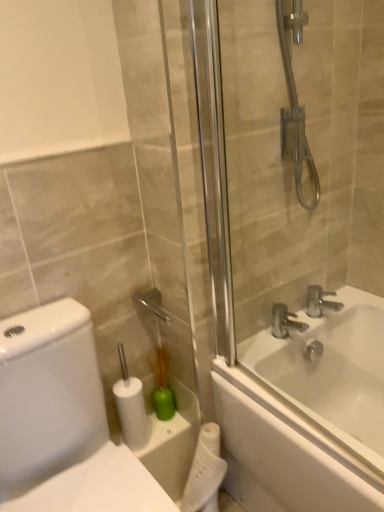
What do you see at coordinates (273, 160) in the screenshot?
I see `transparent glass shower door at right` at bounding box center [273, 160].

What do you see at coordinates (205, 472) in the screenshot? I see `white matte toilet paper at lower center, which is the first toilet paper from right to left` at bounding box center [205, 472].

Locate an element on the screen. Image resolution: width=384 pixels, height=512 pixels. white matte toilet paper at lower center, the 2th toilet paper when ordered from left to right is located at coordinates (205, 472).

What do you see at coordinates (62, 421) in the screenshot? I see `white glossy toilet at left` at bounding box center [62, 421].

Locate an element on the screen. transparent glass shower door at right is located at coordinates (273, 160).

In terms of width, does white glossy bathtub at center look wider or thinner when compared to white glossy toilet at left?

In the image, white glossy bathtub at center appears to be wider than white glossy toilet at left.

Do you think white glossy bathtub at center is within white glossy toilet at left, or outside of it?

white glossy bathtub at center exists outside the volume of white glossy toilet at left.

Considering the sizes of white glossy bathtub at center and white glossy toilet at left in the image, is white glossy bathtub at center taller or shorter than white glossy toilet at left?

white glossy bathtub at center is shorter than white glossy toilet at left.

Considering the sizes of white glossy toilet at left and silver metallic faucet at upper right, marked as the 2th tap in a left-to-right arrangement, in the image, is white glossy toilet at left wider or thinner than silver metallic faucet at upper right, marked as the 2th tap in a left-to-right arrangement,?

white glossy toilet at left is wider than silver metallic faucet at upper right, marked as the 2th tap in a left-to-right arrangement.

Is white glossy toilet at left shorter than silver metallic faucet at upper right, marked as the 2th tap in a left-to-right arrangement?

Incorrect, the height of white glossy toilet at left does not fall short of that of silver metallic faucet at upper right, marked as the 2th tap in a left-to-right arrangement.

Who is bigger, white glossy toilet at left or silver metallic faucet at upper right, marked as the 2th tap in a left-to-right arrangement?

With larger size is white glossy toilet at left.

From the image's perspective, would you say white glossy toilet at left is positioned over silver metallic faucet at upper right, marked as the 2th tap in a left-to-right arrangement?

No, from the image's perspective, white glossy toilet at left is not over silver metallic faucet at upper right, marked as the 2th tap in a left-to-right arrangement.

Considering the positions of objects silver metallic faucet at upper right, which is the 1th tap in right-to-left order, and white matte toilet paper at lower center, which is counted as the second toilet paper, starting from the right, in the image provided, who is in front, silver metallic faucet at upper right, which is the 1th tap in right-to-left order, or white matte toilet paper at lower center, which is counted as the second toilet paper, starting from the right,?

white matte toilet paper at lower center, which is counted as the second toilet paper, starting from the right.

Consider the image. Is silver metallic faucet at upper right, which is the 1th tap in right-to-left order, not near white matte toilet paper at lower center, which is counted as the second toilet paper, starting from the right?

No.

Looking at this image, from a real-world perspective, relative to white matte toilet paper at lower center, which is counted as the second toilet paper, starting from the right, is silver metallic faucet at upper right, marked as the 2th tap in a left-to-right arrangement, vertically above or below?

silver metallic faucet at upper right, marked as the 2th tap in a left-to-right arrangement, is above white matte toilet paper at lower center, which is counted as the second toilet paper, starting from the right.

Is point (310, 295) less distant than point (143, 437)?

No, it is not.

Is silver metallic faucet at upper right, which is the 1th tap in right-to-left order, located outside silver metallic faucet at upper right, the 1th tap from the left?

Yes, silver metallic faucet at upper right, which is the 1th tap in right-to-left order, is located beyond the bounds of silver metallic faucet at upper right, the 1th tap from the left.

Is silver metallic faucet at upper right, marked as the 2th tap in a left-to-right arrangement, aimed at silver metallic faucet at upper right, positioned as the 2th tap in right-to-left order?

No, silver metallic faucet at upper right, marked as the 2th tap in a left-to-right arrangement, is not aimed at silver metallic faucet at upper right, positioned as the 2th tap in right-to-left order.

From a real-world perspective, is silver metallic faucet at upper right, which is the 1th tap in right-to-left order, on silver metallic faucet at upper right, positioned as the 2th tap in right-to-left order?

Correct, in the physical world, silver metallic faucet at upper right, which is the 1th tap in right-to-left order, is higher than silver metallic faucet at upper right, positioned as the 2th tap in right-to-left order.

Is silver metallic faucet at upper right, which is the 1th tap in right-to-left order, not close to silver metallic faucet at upper right, the 1th tap from the left?

That's not correct — silver metallic faucet at upper right, which is the 1th tap in right-to-left order, is a little close to silver metallic faucet at upper right, the 1th tap from the left.

Looking at this image, from the image's perspective, which one is positioned higher, white glossy toilet at left or green plastic brush at lower center?

From the image's view, green plastic brush at lower center is above.

Based on the photo, do you think white glossy toilet at left is within green plastic brush at lower center, or outside of it?

white glossy toilet at left lies outside green plastic brush at lower center.

Could you tell me if white glossy toilet at left is turned towards green plastic brush at lower center?

No, white glossy toilet at left is not oriented towards green plastic brush at lower center.

Would you say transparent glass shower door at right is outside silver metallic faucet at upper right, the 1th tap from the left?

transparent glass shower door at right lies outside silver metallic faucet at upper right, the 1th tap from the left,'s area.

From a real-world perspective, is transparent glass shower door at right physically located above or below silver metallic faucet at upper right, the 1th tap from the left?

Clearly, from a real-world perspective, transparent glass shower door at right is above silver metallic faucet at upper right, the 1th tap from the left.

Is point (277, 79) farther from viewer compared to point (280, 335)?

No.

Could you tell me if transparent glass shower door at right is facing silver metallic faucet at upper right, positioned as the 2th tap in right-to-left order?

No, transparent glass shower door at right is not turned towards silver metallic faucet at upper right, positioned as the 2th tap in right-to-left order.

Find the location of a particular element. This screenshot has width=384, height=512. the 2nd toilet paper below the silver metallic faucet at upper right, which is the 1th tap in right-to-left order (from the image's perspective) is located at coordinates (205, 472).

Is silver metallic faucet at upper right, which is the 1th tap in right-to-left order, beside white matte toilet paper at lower center, the 2th toilet paper when ordered from left to right?

They are not placed beside each other.

What's the angular difference between silver metallic faucet at upper right, marked as the 2th tap in a left-to-right arrangement, and white matte toilet paper at lower center, which is the first toilet paper from right to left,'s facing directions?

There is a 0.935-degree angle between the facing directions of silver metallic faucet at upper right, marked as the 2th tap in a left-to-right arrangement, and white matte toilet paper at lower center, which is the first toilet paper from right to left.

From a real-world perspective, is silver metallic faucet at upper right, which is the 1th tap in right-to-left order, physically above white matte toilet paper at lower center, which is the first toilet paper from right to left?

Indeed, from a real-world perspective, silver metallic faucet at upper right, which is the 1th tap in right-to-left order, stands above white matte toilet paper at lower center, which is the first toilet paper from right to left.

Identify the location of porcelain below the white glossy bathtub at center (from the image's perspective). (62, 421).

There is a white glossy toilet at left. Where is `the 2nd tap above it (from a real-world perspective)`? The height and width of the screenshot is (512, 384). the 2nd tap above it (from a real-world perspective) is located at coordinates (320, 301).

When comparing their distances from white glossy bathtub at center, does silver metallic faucet at upper right, the 1th tap from the left, or green plastic brush at lower center seem closer?

silver metallic faucet at upper right, the 1th tap from the left, is positioned closer to the anchor white glossy bathtub at center.

Estimate the real-world distances between objects in this image. Which object is further from white glossy bathtub at center, green plastic brush at lower center or white matte toilet paper at lower center, which is the 2th toilet paper in top-to-bottom order?

The object further to white glossy bathtub at center is green plastic brush at lower center.

Based on their spatial positions, is silver metallic faucet at upper right, positioned as the 2th tap in right-to-left order, or silver metallic faucet at upper right, marked as the 2th tap in a left-to-right arrangement, further from transparent glass shower door at right?

The object further to transparent glass shower door at right is silver metallic faucet at upper right, marked as the 2th tap in a left-to-right arrangement.

When comparing their distances from white glossy toilet at left, does silver metallic faucet at upper right, the 1th tap from the left, or white glossy bathtub at center seem further?

silver metallic faucet at upper right, the 1th tap from the left, is positioned further to the anchor white glossy toilet at left.

From the image, which object appears to be nearer to silver metallic faucet at upper right, the 1th tap from the left, white matte toilet paper at lower center, which is the 2th toilet paper in top-to-bottom order, or transparent glass shower door at right?

transparent glass shower door at right.

Which object lies nearer to the anchor point silver metallic faucet at upper right, positioned as the 2th tap in right-to-left order, silver metallic faucet at upper right, which is the 1th tap in right-to-left order, or white glossy bathtub at center?

Among the two, silver metallic faucet at upper right, which is the 1th tap in right-to-left order, is located nearer to silver metallic faucet at upper right, positioned as the 2th tap in right-to-left order.

Which object lies nearer to the anchor point white matte toilet paper at lower center, the 2th toilet paper in the bottom-to-top sequence, silver metallic faucet at upper right, which is the 1th tap in right-to-left order, or transparent glass shower door at right?

The object closer to white matte toilet paper at lower center, the 2th toilet paper in the bottom-to-top sequence, is transparent glass shower door at right.

Considering their positions, is white glossy bathtub at center positioned further to transparent glass shower door at right than white matte toilet paper at lower center, the 2th toilet paper in the bottom-to-top sequence?

Based on the image, white matte toilet paper at lower center, the 2th toilet paper in the bottom-to-top sequence, appears to be further to transparent glass shower door at right.

You are a GUI agent. You are given a task and a screenshot of the screen. Output one action in this format:
    pyautogui.click(x=<x>, y=<y>)
    Task: Click on the porcelain positioned between transparent glass shower door at right and silver metallic faucet at upper right, which is the 1th tap in right-to-left order, from near to far
    The height and width of the screenshot is (512, 384).
    Given the screenshot: What is the action you would take?
    pyautogui.click(x=62, y=421)

Find the location of a particular element. This screenshot has width=384, height=512. porcelain positioned between transparent glass shower door at right and white matte toilet paper at lower center, the 2th toilet paper in the bottom-to-top sequence, from near to far is located at coordinates (62, 421).

Identify the location of bathtub that lies between transparent glass shower door at right and white matte toilet paper at lower center, the first toilet paper ordered from the bottom, from top to bottom. The height and width of the screenshot is (512, 384). (308, 413).

The width and height of the screenshot is (384, 512). What are the coordinates of `porcelain positioned between transparent glass shower door at right and green plastic brush at lower center from near to far` in the screenshot? It's located at (62, 421).